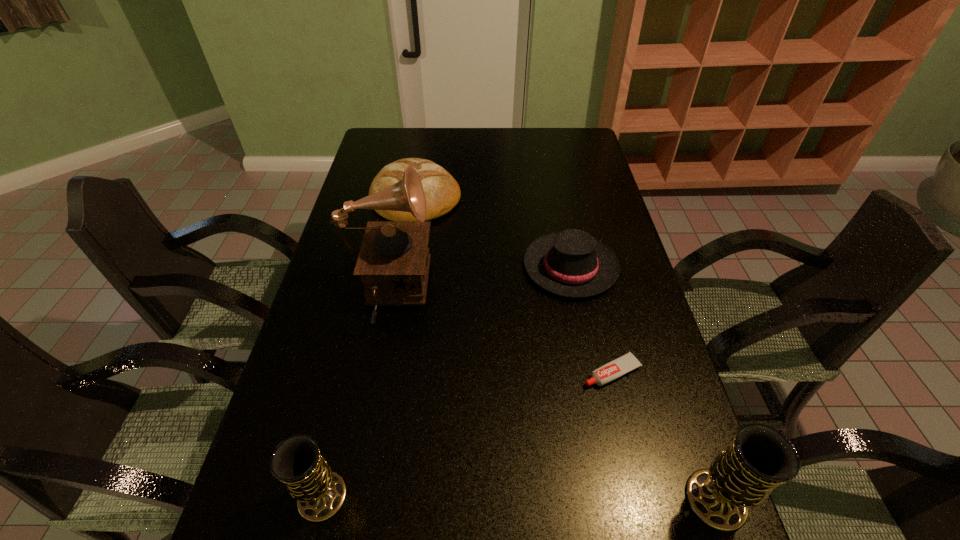
Locate an element on the screen. the third tallest object is located at coordinates (320, 492).

I want to click on the left chalice, so click(320, 492).

Locate an element on the screen. the taller chalice is located at coordinates (760, 458).

Where is `the right chalice`? The height and width of the screenshot is (540, 960). the right chalice is located at coordinates (760, 458).

Identify the location of record player. pyautogui.click(x=393, y=262).

You are a GUI agent. You are given a task and a screenshot of the screen. Output one action in this format:
    pyautogui.click(x=<x>, y=<y>)
    Task: Click on the shortest object
    This screenshot has width=960, height=540.
    Given the screenshot: What is the action you would take?
    pyautogui.click(x=628, y=362)

Where is `toothpaste`? This screenshot has width=960, height=540. toothpaste is located at coordinates (628, 362).

The image size is (960, 540). I want to click on bread, so click(x=442, y=192).

The height and width of the screenshot is (540, 960). What are the coordinates of `dress hat` in the screenshot? It's located at (571, 263).

Identify the location of free space located on the right of the fourth shortest object. (408, 496).